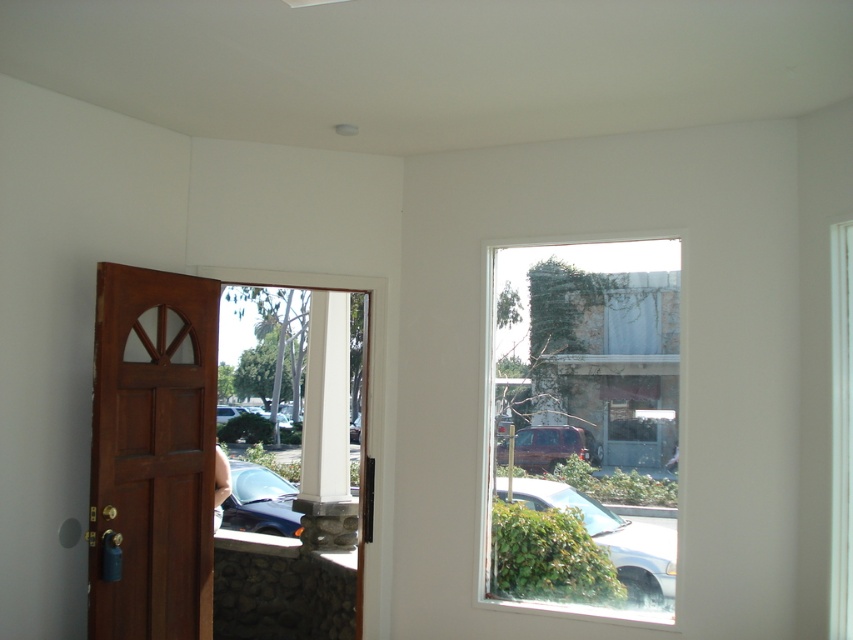
Question: Which is nearer to the shiny blue car at lower left?

Choices:
 (A) stone textured wall at upper right
 (B) brown wooden door at left

Answer: (B)

Question: Where is stone textured wall at upper right located in relation to metallic silver car at window in the image?

Choices:
 (A) left
 (B) right

Answer: (A)

Question: Observing the image, what is the correct spatial positioning of brown wooden door at left in reference to shiny blue car at lower left?

Choices:
 (A) above
 (B) below

Answer: (A)

Question: Estimate the real-world distances between objects in this image. Which object is farther from the matte red suv at center?

Choices:
 (A) metallic silver car at window
 (B) stone textured wall at upper right

Answer: (A)

Question: Is metallic silver car at window above shiny blue car at lower left?

Choices:
 (A) yes
 (B) no

Answer: (A)

Question: Which point is closer to the camera?

Choices:
 (A) (277, 474)
 (B) (175, 552)
 (C) (641, 602)

Answer: (B)